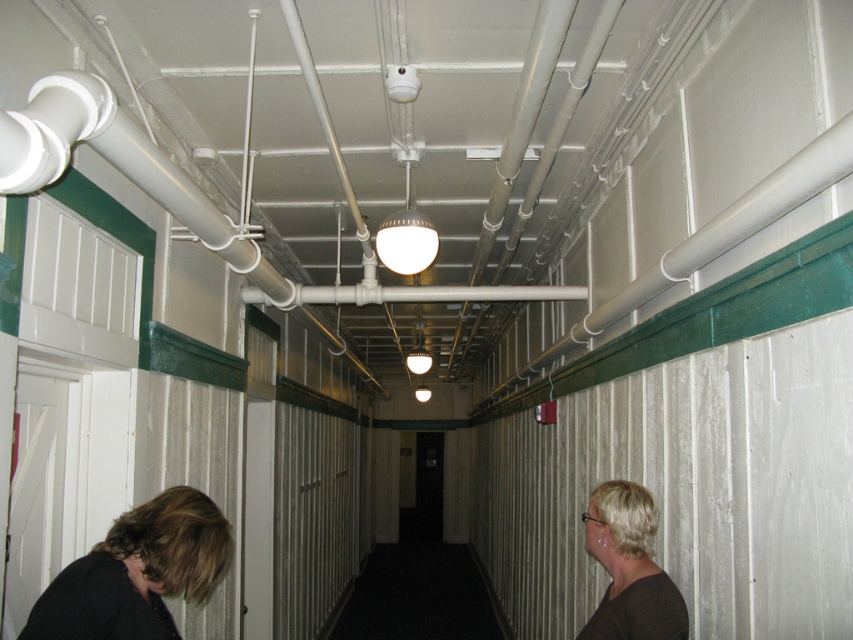
Consider the image. You are a maintenance worker needing to access the white matte pipe at upper center and the black carpet at center. Which object is closer to you from your current position in the hallway?

The white matte pipe at upper center is closer to you than the black carpet at center because it is in front of it.

You are a maintenance worker in the hallway. You need to check the length of the black carpet at center and the blonde hair at right. Which one has a greater length?

The blonde hair at right is longer than the black carpet at center.